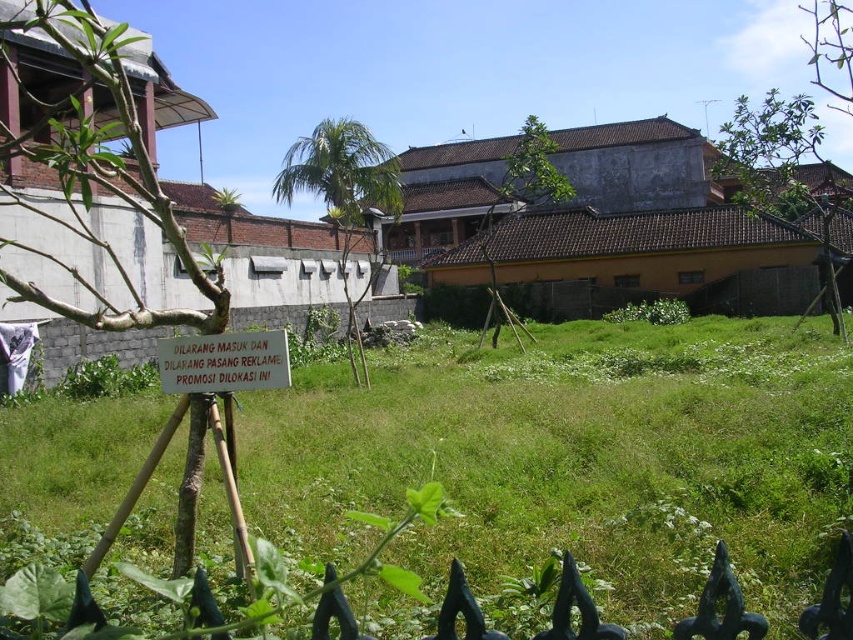
Question: Does green grassy at center come behind white paper sign at center?

Choices:
 (A) no
 (B) yes

Answer: (A)

Question: Is green grassy at center wider than white paper sign at center?

Choices:
 (A) no
 (B) yes

Answer: (B)

Question: Which of the following is the farthest from the observer?

Choices:
 (A) white paper sign at center
 (B) green grassy at center

Answer: (A)

Question: Can you confirm if green grassy at center is thinner than white paper sign at center?

Choices:
 (A) no
 (B) yes

Answer: (A)

Question: Which point is farther to the camera?

Choices:
 (A) green grassy at center
 (B) white paper sign at center

Answer: (B)

Question: Which object appears closest to the camera in this image?

Choices:
 (A) green grassy at center
 (B) white paper sign at center

Answer: (A)